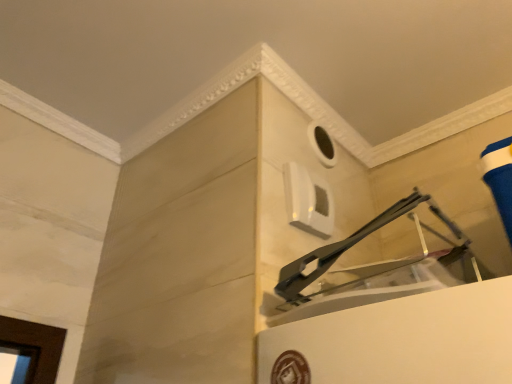
Looking at this image, measure the distance between point (328, 157) and camera.

A distance of 1.38 meters exists between point (328, 157) and camera.

The height and width of the screenshot is (384, 512). What do you see at coordinates (322, 144) in the screenshot? I see `white matte hole at upper center` at bounding box center [322, 144].

What is the approximate height of white matte hole at upper center?

14.94 centimeters.

The image size is (512, 384). In order to click on white matte hole at upper center in this screenshot , I will do `click(322, 144)`.

Measure the distance between white plastic window at upper center and camera.

white plastic window at upper center and camera are 1.04 meters apart.

The height and width of the screenshot is (384, 512). Describe the element at coordinates (308, 201) in the screenshot. I see `white plastic window at upper center` at that location.

Where is `white plastic window at upper center`? This screenshot has width=512, height=384. white plastic window at upper center is located at coordinates (308, 201).

Where is `white matte hole at upper center`? This screenshot has height=384, width=512. white matte hole at upper center is located at coordinates (x=322, y=144).

Based on their positions, is white matte hole at upper center located to the left or right of white plastic window at upper center?

Based on their positions, white matte hole at upper center is located to the right of white plastic window at upper center.

Who is more distant, white matte hole at upper center or white plastic window at upper center?

white matte hole at upper center is further away from the camera.

Is point (316, 133) positioned behind point (322, 228)?

Yes, point (316, 133) is farther from viewer.

In the scene shown: From the image's perspective, is white matte hole at upper center located above white plastic window at upper center?

Correct, white matte hole at upper center appears higher than white plastic window at upper center in the image.

From a real-world perspective, is white matte hole at upper center on top of white plastic window at upper center?

Yes, from a real-world perspective, white matte hole at upper center is above white plastic window at upper center.

Between white matte hole at upper center and white plastic window at upper center, which one has larger width?

With larger width is white plastic window at upper center.

Which of these two, white matte hole at upper center or white plastic window at upper center, stands taller?

With more height is white plastic window at upper center.

Considering the sizes of objects white matte hole at upper center and white plastic window at upper center in the image provided, who is bigger, white matte hole at upper center or white plastic window at upper center?

With larger size is white plastic window at upper center.

Is white matte hole at upper center situated inside white plastic window at upper center or outside?

white matte hole at upper center is spatially situated outside white plastic window at upper center.

Is white matte hole at upper center directly adjacent to white plastic window at upper center?

There is a gap between white matte hole at upper center and white plastic window at upper center.

Is white matte hole at upper center oriented away from white plastic window at upper center?

No, white matte hole at upper center is not facing the opposite direction of white plastic window at upper center.

Can you tell me how much white matte hole at upper center and white plastic window at upper center differ in facing direction?

white matte hole at upper center and white plastic window at upper center are facing 1.25 degrees away from each other.

Locate an element on the screen. The width and height of the screenshot is (512, 384). hole above the white plastic window at upper center (from the image's perspective) is located at coordinates (322, 144).

Considering the relative positions of white plastic window at upper center and white matte hole at upper center in the image provided, is white plastic window at upper center to the left or to the right of white matte hole at upper center?

From the image, it's evident that white plastic window at upper center is to the left of white matte hole at upper center.

Is white plastic window at upper center in front of or behind white matte hole at upper center in the image?

In the image, white plastic window at upper center appears in front of white matte hole at upper center.

Considering the positions of points (305, 230) and (311, 131), is point (305, 230) closer to camera compared to point (311, 131)?

Yes, point (305, 230) is in front of point (311, 131).

Consider the image. From the image's perspective, between white plastic window at upper center and white matte hole at upper center, who is located below?

white plastic window at upper center appears lower in the image.

From a real-world perspective, is white plastic window at upper center located higher than white matte hole at upper center?

No, from a real-world perspective, white plastic window at upper center is not over white matte hole at upper center

Does white plastic window at upper center have a greater width compared to white matte hole at upper center?

Correct, the width of white plastic window at upper center exceeds that of white matte hole at upper center.

In terms of height, does white plastic window at upper center look taller or shorter compared to white matte hole at upper center?

white plastic window at upper center is taller than white matte hole at upper center.

Is white plastic window at upper center smaller than white matte hole at upper center?

No.

Would you say white plastic window at upper center contains white matte hole at upper center?

No, white matte hole at upper center is not a part of white plastic window at upper center.

Can you see white plastic window at upper center touching white matte hole at upper center?

No, white plastic window at upper center is not next to white matte hole at upper center.

Is white plastic window at upper center looking in the opposite direction of white matte hole at upper center?

No, white plastic window at upper center is not facing away from white matte hole at upper center.

How different are the orientations of white plastic window at upper center and white matte hole at upper center in degrees?

The angle between the facing direction of white plastic window at upper center and the facing direction of white matte hole at upper center is 1.25 degrees.

In the image, there is a white matte hole at upper center. Where is `window below it (from a real-world perspective)`? Image resolution: width=512 pixels, height=384 pixels. window below it (from a real-world perspective) is located at coordinates (308, 201).

At what (x,y) coordinates should I click in order to perform the action: click on window beneath the white matte hole at upper center (from a real-world perspective). Please return your answer as a coordinate pair (x, y). Looking at the image, I should click on (308, 201).

Identify the location of window below the white matte hole at upper center (from the image's perspective). This screenshot has height=384, width=512. (308, 201).